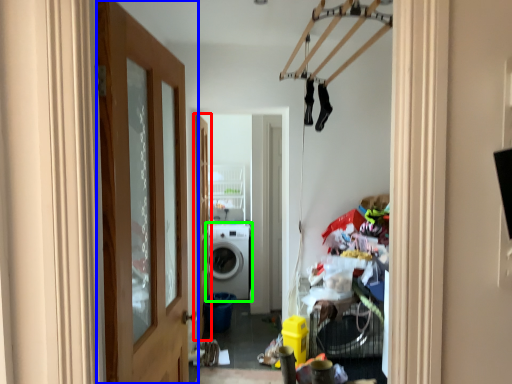
Question: Which object is positioned farthest from door (highlighted by a red box)? Select from door (highlighted by a blue box) and washing machine (highlighted by a green box).

Choices:
 (A) door
 (B) washing machine

Answer: (A)